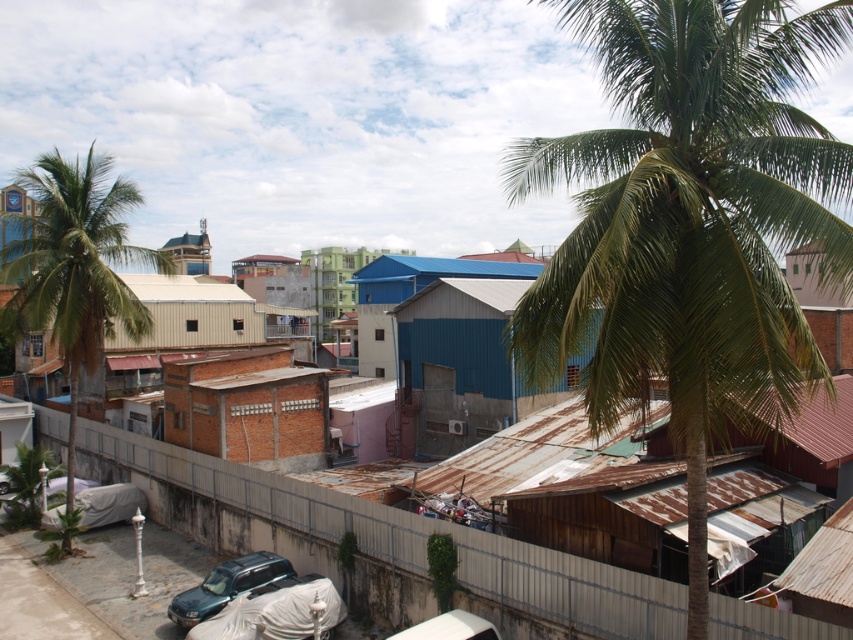
You are standing in the urban scene and want to take a photo of both green leafy palm tree at upper right and green leafy palm tree at left. Which palm tree is positioned more to the right side of the image?

The green leafy palm tree at upper right is positioned more to the right side of the image compared to the green leafy palm tree at left.

You are standing in the urban scene described and want to determine the relative positions of two points marked in the image. Which point, point 1 at coordinates (616,48) or point 2 at coordinates (97,269), is closer to you?

Point 1 at coordinates (616,48) is closer to the viewer than point 2 at coordinates (97,269) according to the description.

You are a drone operator tasked with capturing aerial footage of the urban scene. You need to fly your drone between the two green leafy palm trees mentioned in the scene. What is the minimum horizontal distance your drone must cover to fly between the green leafy palm tree at upper right and the green leafy palm tree at left?

The green leafy palm tree at upper right is 37.49 meters away from the green leafy palm tree at left, so the minimum horizontal distance the drone must cover is 37.49 meters.